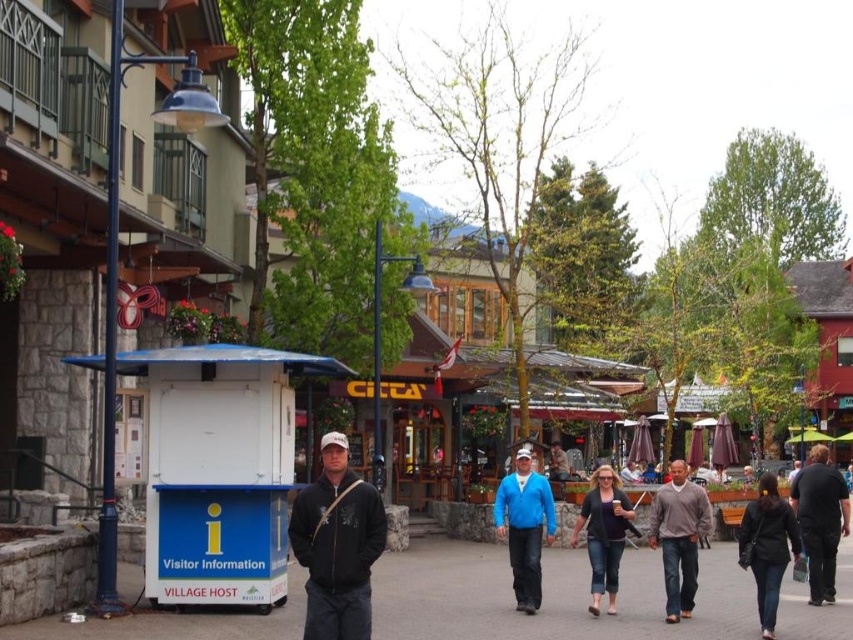
You are a tailor who needs to determine which clothing item requires more fabric to make between the brown sweater at center and the dark brown leather jacket at lower right. Based on the image, which one would need more fabric?

The dark brown leather jacket at lower right requires more fabric since its width is greater than the brown sweater at center.

You are a tourist standing on the walkway and want to check the Village Host booth. You notice dark gray asphalt at center and denim pants at center. Which one is positioned to the left of the other?

dark gray asphalt at center is to the left of denim pants at center.